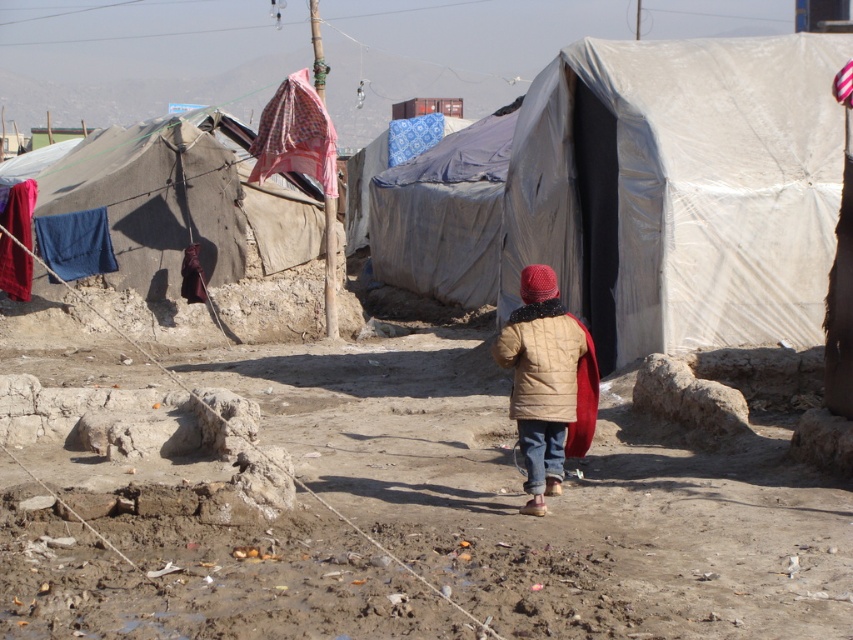
Does brown dirt field at center have a greater height compared to red fabric at left?

In fact, brown dirt field at center may be shorter than red fabric at left.

Who is more distant from viewer, (601, 579) or (19, 266)?

Point (19, 266)

Is point (122, 568) more distant than point (9, 252)?

No, it is in front of (9, 252).

Find the location of a particular element. brown dirt field at center is located at coordinates (554, 499).

Who is more forward, (775, 97) or (537, 310)?

Point (537, 310) is more forward.

Does white tarpaulin tent at center come behind matte beige jacket at center?

Yes.

What do you see at coordinates (680, 189) in the screenshot? I see `white tarpaulin tent at center` at bounding box center [680, 189].

Find the location of a particular element. The width and height of the screenshot is (853, 640). white tarpaulin tent at center is located at coordinates (680, 189).

Is brown dirt field at center above blue fabric at left?

No, brown dirt field at center is not above blue fabric at left.

Between point (280, 438) and point (53, 269), which one is positioned behind?

The point (53, 269) is more distant.

Does point (517, 609) lie behind point (80, 211)?

No, it is not.

Locate an element on the screen. brown dirt field at center is located at coordinates (554, 499).